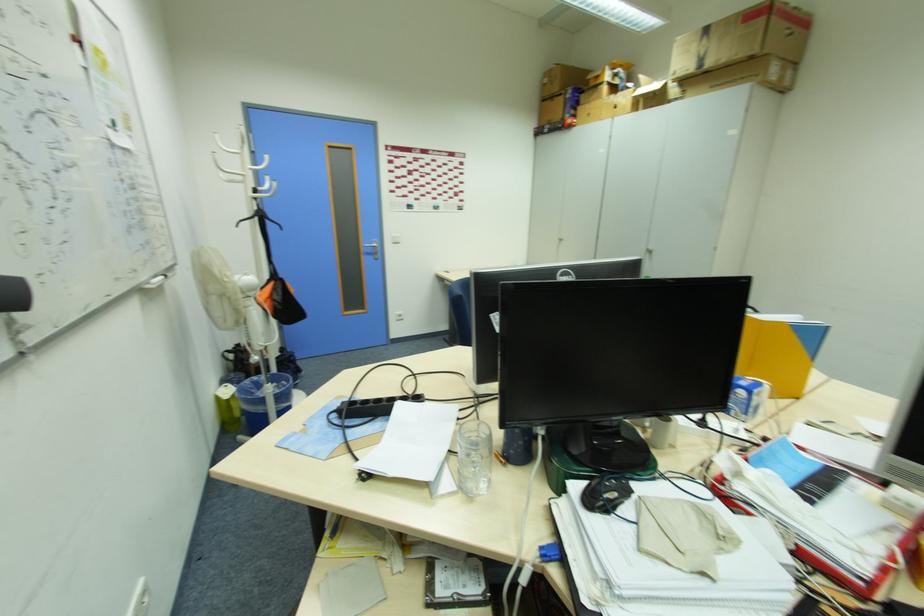
Find where to lift the black and orange bag. Please return your answer as a coordinate pair (x, y).

(280, 301)